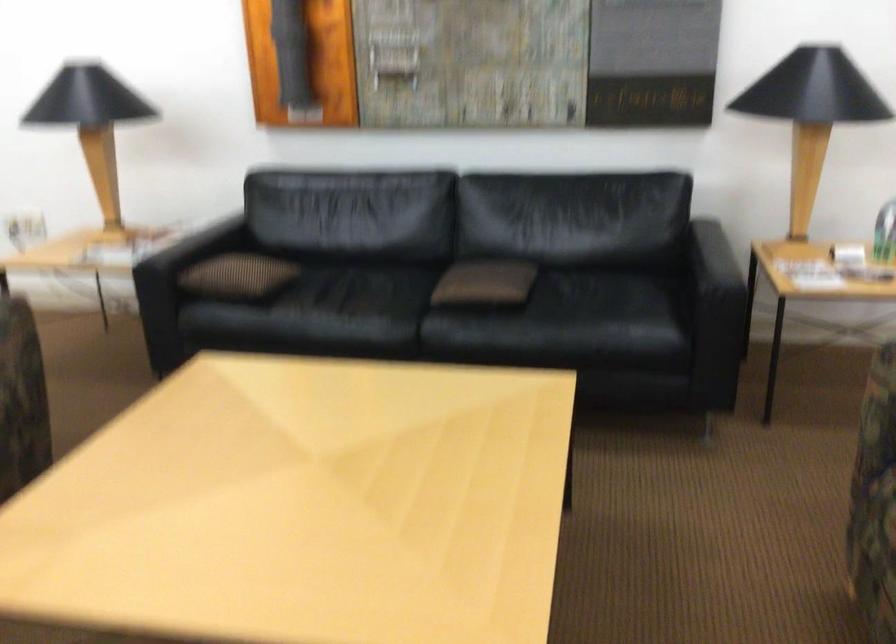
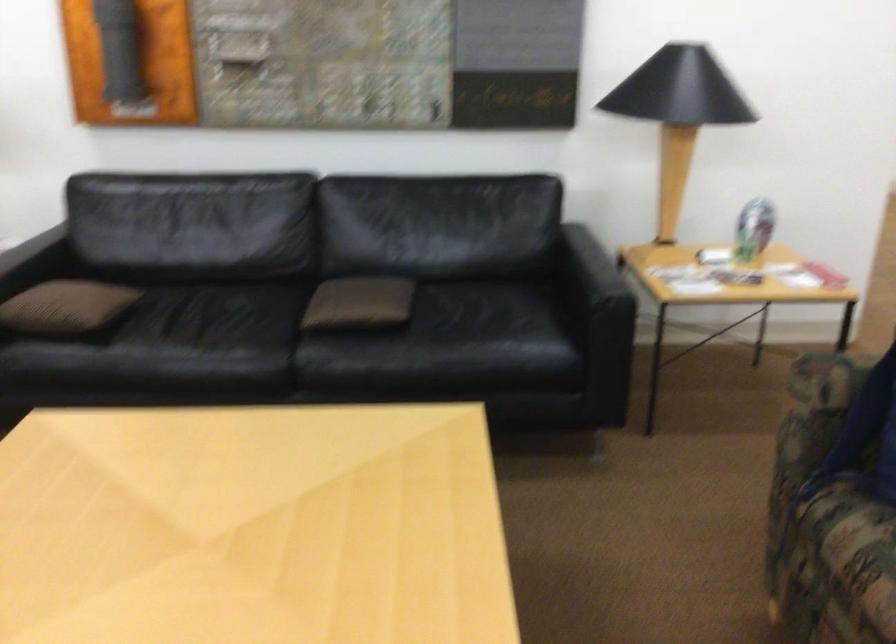
Locate, in the second image, the point that corresponds to point 234,279 in the first image.

(65, 308)